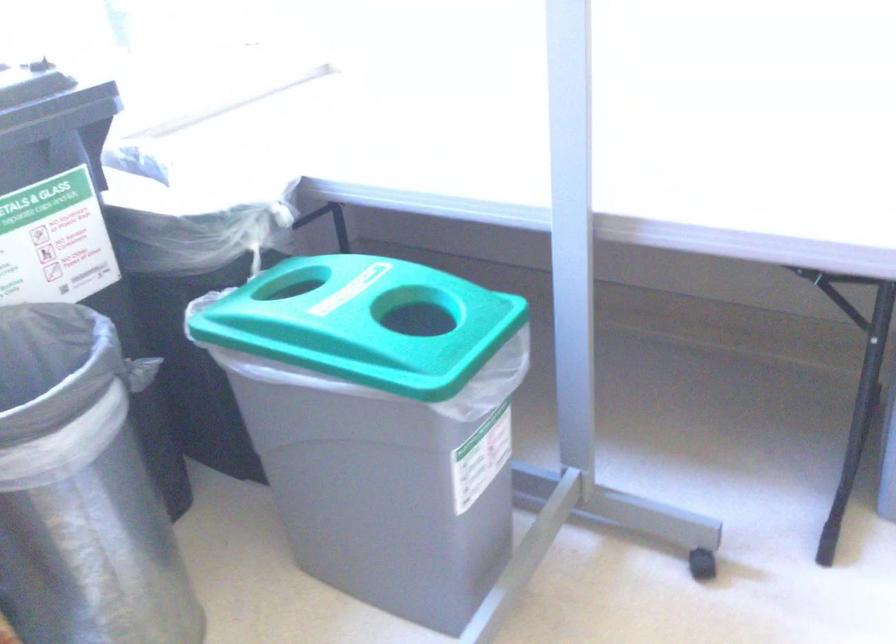
Where would you roll the black wheel? Please return your answer as a coordinate pair (x, y).

(702, 564)